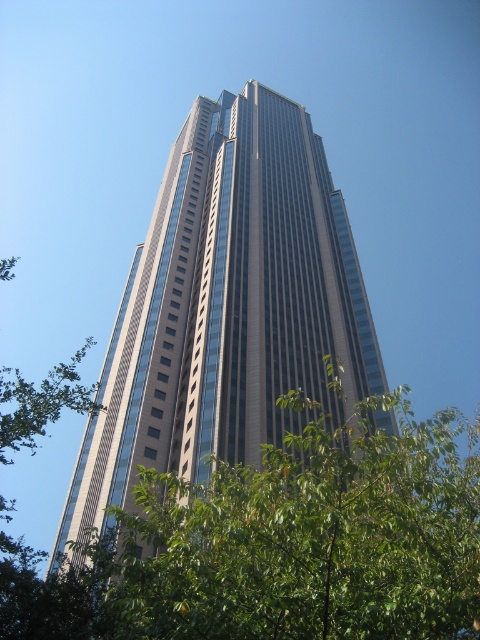
Question: Which object is farther from the camera taking this photo?

Choices:
 (A) green leafy tree at center
 (B) glassy steel skyscraper at center

Answer: (B)

Question: From the image, what is the correct spatial relationship of glassy steel skyscraper at center in relation to green leafy tree at center?

Choices:
 (A) right
 (B) left

Answer: (B)

Question: Which point appears farthest from the camera in this image?

Choices:
 (A) (201, 237)
 (B) (478, 525)

Answer: (A)

Question: Does glassy steel skyscraper at center have a smaller size compared to green leafy tree at center?

Choices:
 (A) yes
 (B) no

Answer: (B)

Question: Which point is farther to the camera?

Choices:
 (A) (202, 472)
 (B) (132, 541)

Answer: (A)

Question: In this image, where is glassy steel skyscraper at center located relative to green leafy tree at center?

Choices:
 (A) below
 (B) above

Answer: (B)